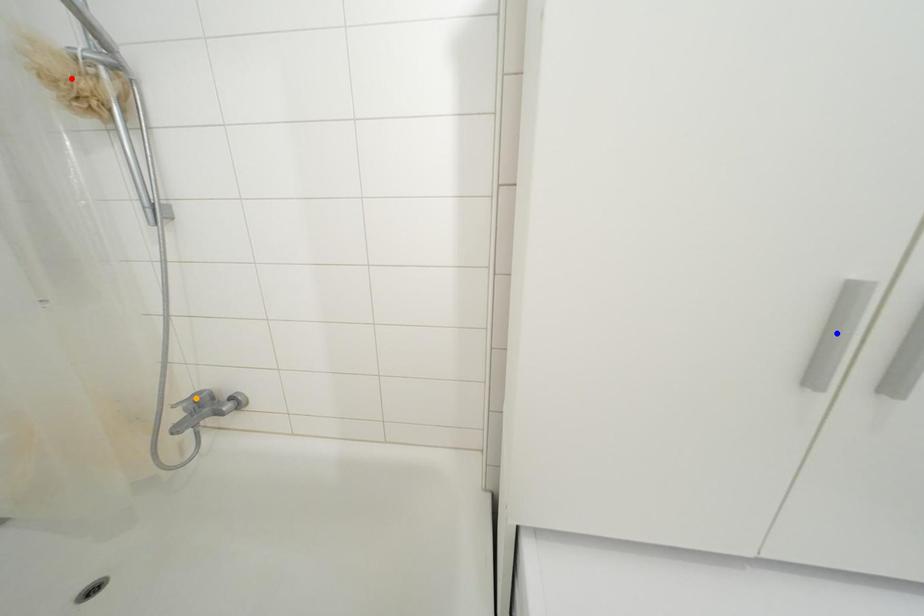
Order these from farthest to nearest:
red point, blue point, orange point

orange point
red point
blue point